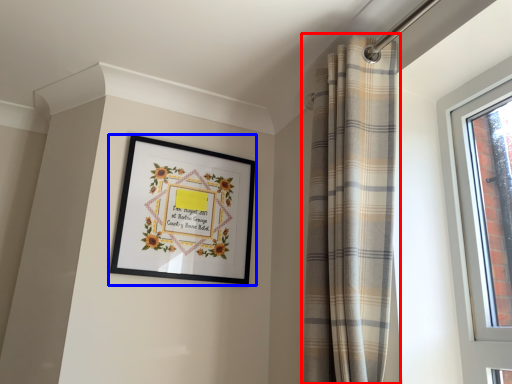
Question: Which object appears farthest to the camera in this image, curtain (highlighted by a red box) or picture frame (highlighted by a blue box)?

Choices:
 (A) curtain
 (B) picture frame

Answer: (B)